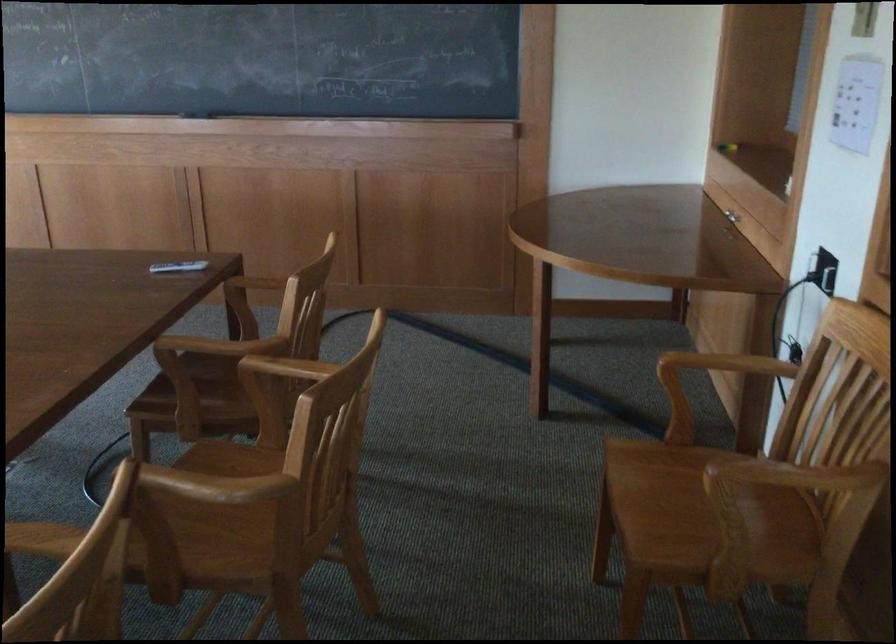
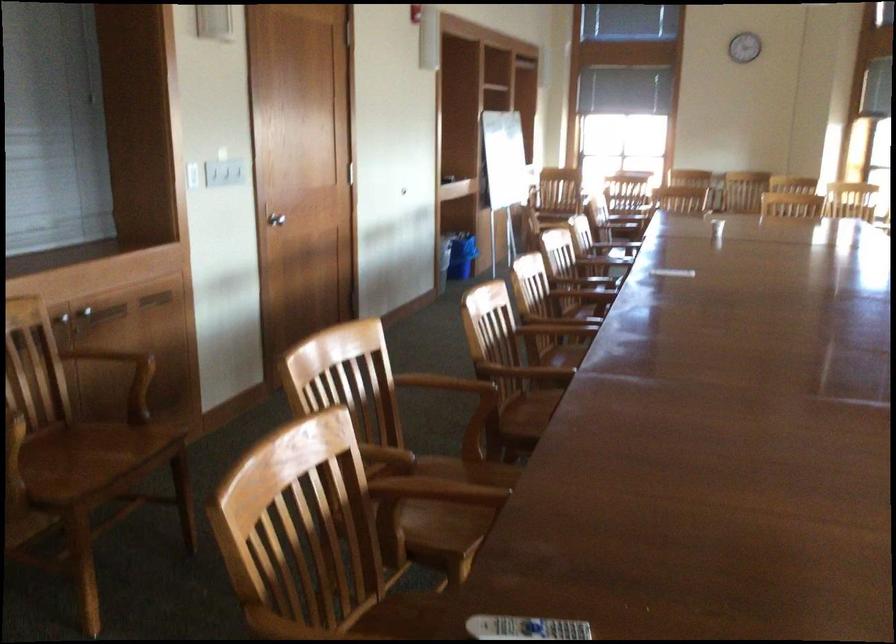
Where in the second image is the point corresponding to point (69, 308) from the first image?

(524, 628)